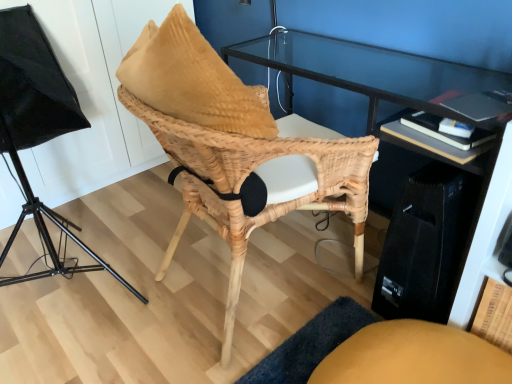
Question: Should I look upward or downward to see natural woven chair at center?

Choices:
 (A) down
 (B) up

Answer: (B)

Question: Considering the relative positions of natural woven chair at center and black fabric lampshade at left in the image provided, is natural woven chair at center to the left of black fabric lampshade at left from the viewer's perspective?

Choices:
 (A) yes
 (B) no

Answer: (B)

Question: From the image's perspective, is natural woven chair at center above black fabric lampshade at left?

Choices:
 (A) yes
 (B) no

Answer: (B)

Question: Is natural woven chair at center wider than black fabric lampshade at left?

Choices:
 (A) yes
 (B) no

Answer: (B)

Question: Considering the relative sizes of natural woven chair at center and black fabric lampshade at left in the image provided, is natural woven chair at center smaller than black fabric lampshade at left?

Choices:
 (A) no
 (B) yes

Answer: (B)

Question: From the image's perspective, does natural woven chair at center appear lower than black fabric lampshade at left?

Choices:
 (A) yes
 (B) no

Answer: (A)

Question: Is natural woven chair at center thinner than black fabric lampshade at left?

Choices:
 (A) no
 (B) yes

Answer: (B)

Question: From a real-world perspective, is black fabric lampshade at left located beneath natural woven chair at center?

Choices:
 (A) no
 (B) yes

Answer: (A)

Question: Considering the relative sizes of black fabric lampshade at left and natural woven chair at center in the image provided, is black fabric lampshade at left thinner than natural woven chair at center?

Choices:
 (A) no
 (B) yes

Answer: (A)

Question: Is black fabric lampshade at left outside of natural woven chair at center?

Choices:
 (A) yes
 (B) no

Answer: (A)

Question: Would you say black fabric lampshade at left is a long distance from natural woven chair at center?

Choices:
 (A) yes
 (B) no

Answer: (B)

Question: From a real-world perspective, is black fabric lampshade at left on top of natural woven chair at center?

Choices:
 (A) no
 (B) yes

Answer: (B)

Question: Does black fabric lampshade at left appear on the right side of natural woven chair at center?

Choices:
 (A) yes
 (B) no

Answer: (B)

Question: Based on their sizes in the image, would you say black fabric lampshade at left is bigger or smaller than natural woven chair at center?

Choices:
 (A) small
 (B) big

Answer: (B)